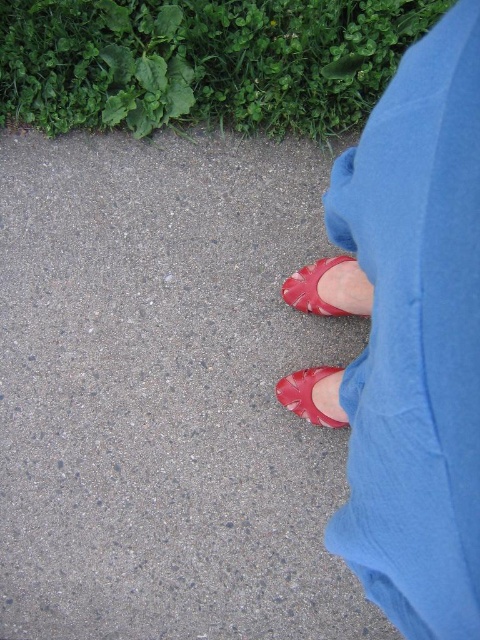
You are a fashion designer observing the image of two shoes. The scene shows a person walking on a paved path with greenery in the background. You need to determine which shoe is higher in height between the matte leather shoe at lower center and the matte red shoe at lower center. Which one is taller?

The matte leather shoe at lower center is taller than the matte red shoe at lower center according to the description.

You are standing at the position of the viewer and see the matte red shoes at lower center. If you want to reach the shoes, how many steps would you need to take to get there?

The matte red shoes at lower center are 24.94 inches away from the viewer. Assuming an average step length of about 2.5 feet, which is approximately 30 inches, the distance of 24.94 inches is less than one full step. Therefore, you would only need to take a single step forward to reach the matte red shoes at lower center.

You are a fashion designer observing a person wearing two shoes. You notice the matte leather shoe at lower center and the matte red shoe at lower center. Which one has a bigger size?

The matte leather shoe at lower center has a larger size compared to the matte red shoe at lower center.